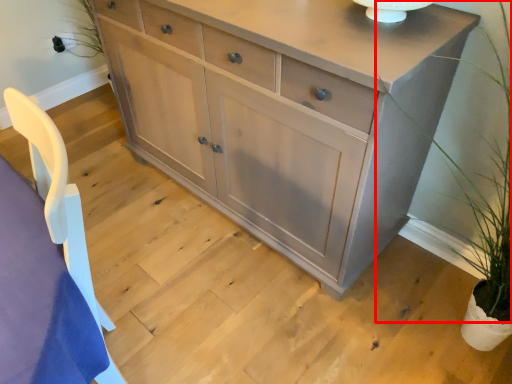
Question: Observing the image, what is the correct spatial positioning of plant (annotated by the red box) in reference to chest of drawers?

Choices:
 (A) left
 (B) right

Answer: (B)